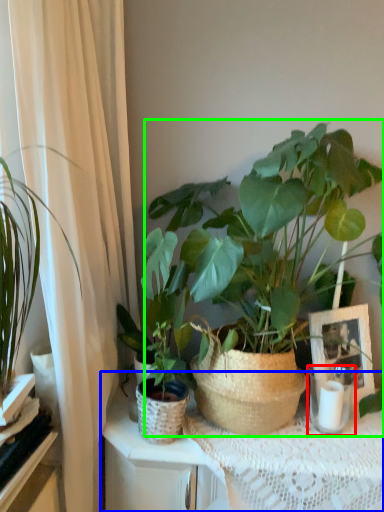
Question: Which object is positioned farthest from candle holder (highlighted by a red box)? Select from table (highlighted by a blue box) and houseplant (highlighted by a green box).

Choices:
 (A) table
 (B) houseplant

Answer: (B)